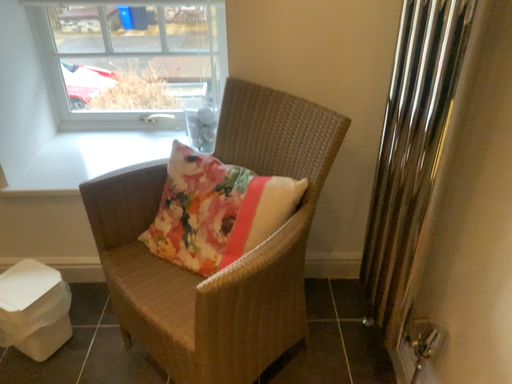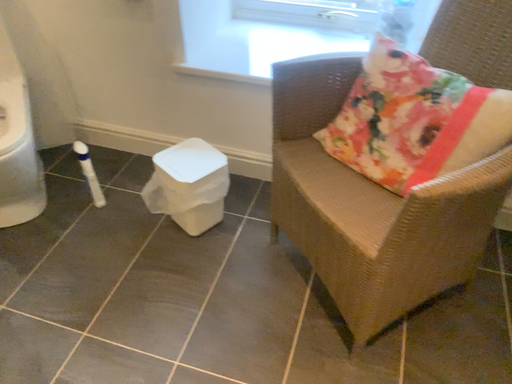
Question: How did the camera likely rotate when shooting the video?

Choices:
 (A) rotated downward
 (B) rotated upward

Answer: (A)